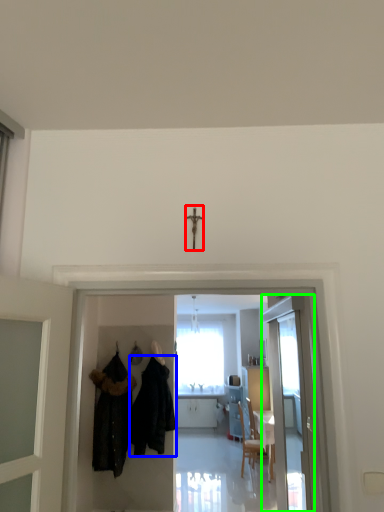
Question: Based on their relative distances, which object is nearer to crucifix (highlighted by a red box)? Choose from fancy dress (highlighted by a blue box) and door (highlighted by a green box).

Choices:
 (A) fancy dress
 (B) door

Answer: (A)